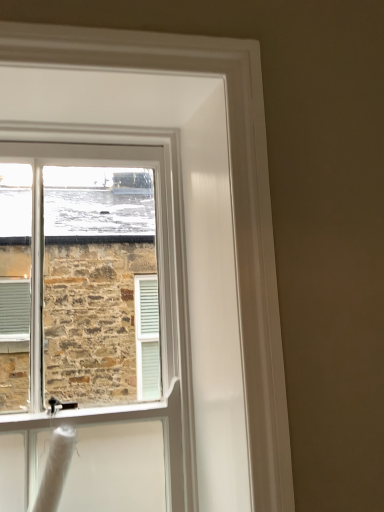
You are a GUI agent. You are given a task and a screenshot of the screen. Output one action in this format:
    pyautogui.click(x=<x>, y=<y>)
    Task: Click on the white glossy window at upper left
    
    Given the screenshot: What is the action you would take?
    pyautogui.click(x=80, y=275)

What do you see at coordinates (80, 275) in the screenshot? This screenshot has height=512, width=384. I see `white glossy window at upper left` at bounding box center [80, 275].

You are a GUI agent. You are given a task and a screenshot of the screen. Output one action in this format:
    pyautogui.click(x=<x>, y=<y>)
    Task: Click on the white glossy window at upper left
    This screenshot has height=512, width=384.
    Given the screenshot: What is the action you would take?
    tap(80, 275)